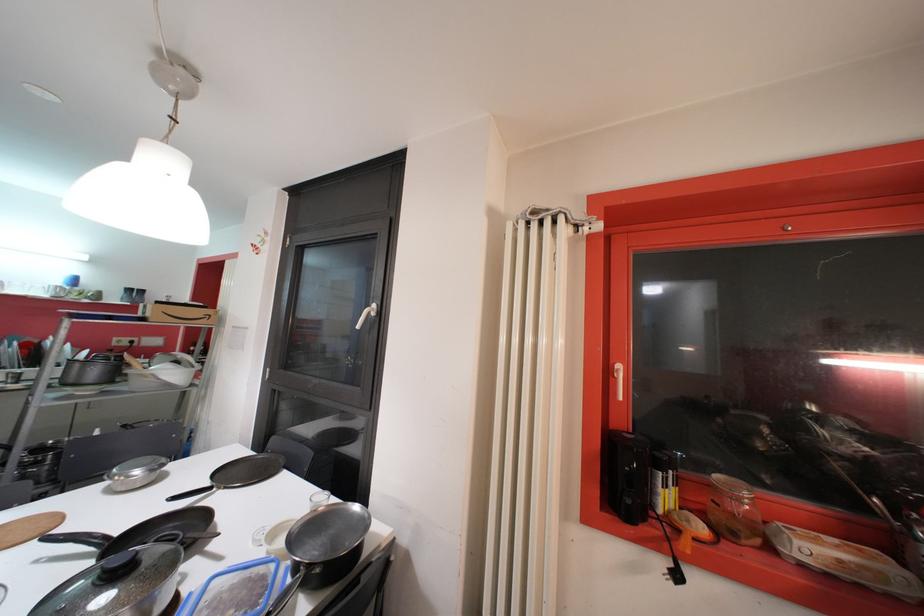
At what (x,y) coordinates should I click in order to perform the action: click on cardboard amazon box. Please return your answer as a coordinate pair (x, y). The width and height of the screenshot is (924, 616). Looking at the image, I should click on (180, 313).